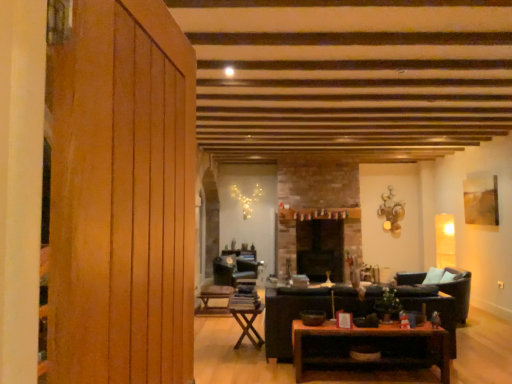
Measure the distance between point (x=421, y=366) and camera.

A distance of 4.20 meters exists between point (x=421, y=366) and camera.

This screenshot has width=512, height=384. Find the location of `brown wooden table at center, the third table from the back`. brown wooden table at center, the third table from the back is located at coordinates (373, 360).

From a real-world perspective, is wooden folding table at center, which is the 3th table from front to back, on black leather couch at center?

Incorrect, from a real-world perspective, wooden folding table at center, which is the 3th table from front to back, is lower than black leather couch at center.

Can you confirm if wooden folding table at center, arranged as the third table when viewed from the right, is bigger than black leather couch at center?

Incorrect, wooden folding table at center, arranged as the third table when viewed from the right, is not larger than black leather couch at center.

Is wooden folding table at center, positioned as the 1th table in back-to-front order, completely or partially outside of black leather couch at center?

Absolutely, wooden folding table at center, positioned as the 1th table in back-to-front order, is external to black leather couch at center.

Does point (251, 264) lie behind point (94, 254)?

Yes, it is behind point (94, 254).

Is the position of velvet dark green armchair at center, marked as the 1th armchair in a left-to-right arrangement, less distant than that of wooden paneling at left?

No, velvet dark green armchair at center, marked as the 1th armchair in a left-to-right arrangement, is behind wooden paneling at left.

Is velvet dark green armchair at center, arranged as the 2th armchair when viewed from the front, positioned far away from wooden paneling at left?

Yes, velvet dark green armchair at center, arranged as the 2th armchair when viewed from the front, and wooden paneling at left are located far from each other.

Is velvet dark green armchair at center, the first armchair when ordered from back to front, completely or partially outside of wooden paneling at left?

Indeed, velvet dark green armchair at center, the first armchair when ordered from back to front, is completely outside wooden paneling at left.

From the image's perspective, between velvet dark green armchair at center, the 2th armchair positioned from the right, and black leather couch at center, who is located below?

velvet dark green armchair at center, the 2th armchair positioned from the right, appears lower in the image.

Considering the relative positions of velvet dark green armchair at center, the 2th armchair positioned from the right, and black leather couch at center in the image provided, is velvet dark green armchair at center, the 2th armchair positioned from the right, to the left or to the right of black leather couch at center?

In the image, velvet dark green armchair at center, the 2th armchair positioned from the right, appears on the left side of black leather couch at center.

Between point (236, 270) and point (283, 322), which one is positioned behind?

Positioned behind is point (236, 270).

Is wooden paneling at left inside the boundaries of velvet dark green armchair at center, the first armchair when ordered from back to front, or outside?

wooden paneling at left is outside velvet dark green armchair at center, the first armchair when ordered from back to front.

Considering the sizes of objects wooden paneling at left and velvet dark green armchair at center, the first armchair when ordered from back to front, in the image provided, who is thinner, wooden paneling at left or velvet dark green armchair at center, the first armchair when ordered from back to front,?

Thinner between the two is wooden paneling at left.

This screenshot has height=384, width=512. I want to click on barn door lying on the right of velvet dark green armchair at center, marked as the 1th armchair in a left-to-right arrangement, so (x=122, y=198).

Is wooden paneling at left next to velvet dark green armchair at center, arranged as the 2th armchair when viewed from the front?

No, wooden paneling at left is not making contact with velvet dark green armchair at center, arranged as the 2th armchair when viewed from the front.

This screenshot has width=512, height=384. In order to click on the 2nd table counting from the left of the brown wooden table at center, which is the 3th table from left to right in this screenshot , I will do `click(214, 298)`.

Does wooden folding table at center, which is the 3th table from front to back, have a greater height compared to brown wooden table at center, marked as the first table in a front-to-back arrangement?

In fact, wooden folding table at center, which is the 3th table from front to back, may be shorter than brown wooden table at center, marked as the first table in a front-to-back arrangement.

Is wooden folding table at center, which is the 3th table from front to back, turned away from brown wooden table at center, which is the 3th table from left to right?

No, wooden folding table at center, which is the 3th table from front to back, is not facing away from brown wooden table at center, which is the 3th table from left to right.

Is dark brown leather armchair at right, which ranks as the 2th armchair in back-to-front order, turned away from brown wooden table at center, the first table from the right?

dark brown leather armchair at right, which ranks as the 2th armchair in back-to-front order, is not turned away from brown wooden table at center, the first table from the right.

Is point (467, 281) behind point (333, 332)?

Yes, it is behind point (333, 332).

Identify the location of table that is above the dark brown leather armchair at right, positioned as the 1th armchair in front-to-back order (from the image's perspective). The height and width of the screenshot is (384, 512). (373, 360).

Based on the photo, can you confirm if dark brown leather armchair at right, which appears as the first armchair when viewed from the right, is wider than brown wooden table at center, which is the 3th table from left to right?

Yes.

From a real-world perspective, who is located higher, brown wooden table at center, which is the 3th table from left to right, or wooden folding table at center, the 2th table from the back?

wooden folding table at center, the 2th table from the back.

Looking at this image, could you tell me if brown wooden table at center, which is the 3th table from left to right, is facing wooden folding table at center, the second table viewed from the left?

No, brown wooden table at center, which is the 3th table from left to right, does not turn towards wooden folding table at center, the second table viewed from the left.

Measure the distance from brown wooden table at center, which is the 3th table from left to right, to wooden folding table at center, the 2th table from the back.

A distance of 3.81 feet exists between brown wooden table at center, which is the 3th table from left to right, and wooden folding table at center, the 2th table from the back.

Is brown wooden table at center, which is the 3th table from left to right, inside or outside of wooden folding table at center, the second table viewed from the left?

brown wooden table at center, which is the 3th table from left to right, lies outside wooden folding table at center, the second table viewed from the left.

You are a GUI agent. You are given a task and a screenshot of the screen. Output one action in this format:
    pyautogui.click(x=<x>, y=<y>)
    Task: Click on the 3rd table positioned below the black leather couch at center (from the image's perspective)
    This screenshot has height=384, width=512.
    Given the screenshot: What is the action you would take?
    pyautogui.click(x=214, y=298)

I want to click on barn door above the velvet dark green armchair at center, the first armchair when ordered from back to front (from the image's perspective), so click(122, 198).

Considering their positions, is brown wooden table at center, the first table from the right, positioned further to wooden folding table at center, which is counted as the 2th table, starting from the front, than wooden folding table at center, arranged as the third table when viewed from the right?

brown wooden table at center, the first table from the right, is positioned further to the anchor wooden folding table at center, which is counted as the 2th table, starting from the front.

Based on their spatial positions, is brown wooden table at center, the third table from the back, or wooden paneling at left further from black leather couch at center?

wooden paneling at left lies further to black leather couch at center than the other object.

Based on their spatial positions, is velvet dark green armchair at center, marked as the 1th armchair in a left-to-right arrangement, or wooden paneling at left further from wooden folding table at center, which ranks as the 1th table in left-to-right order?

The object further to wooden folding table at center, which ranks as the 1th table in left-to-right order, is wooden paneling at left.

Which object lies nearer to the anchor point wooden paneling at left, wooden folding table at center, which ranks as the 1th table in left-to-right order, or brown wooden table at center, which is the 3th table from left to right?

brown wooden table at center, which is the 3th table from left to right, is closer to wooden paneling at left.

Looking at this image, when comparing their distances from dark brown leather armchair at right, positioned as the 1th armchair in front-to-back order, does wooden paneling at left or wooden folding table at center, which appears as the second table when viewed from the right, seem closer?

The object closer to dark brown leather armchair at right, positioned as the 1th armchair in front-to-back order, is wooden folding table at center, which appears as the second table when viewed from the right.

Considering their positions, is wooden folding table at center, which appears as the second table when viewed from the right, positioned further to wooden folding table at center, positioned as the 1th table in back-to-front order, than velvet dark green armchair at center, the first armchair when ordered from back to front?

The object further to wooden folding table at center, positioned as the 1th table in back-to-front order, is wooden folding table at center, which appears as the second table when viewed from the right.

Considering their positions, is dark brown leather armchair at right, which appears as the first armchair when viewed from the right, positioned further to brown wooden table at center, the third table from the back, than black leather couch at center?

Among the two, dark brown leather armchair at right, which appears as the first armchair when viewed from the right, is located further to brown wooden table at center, the third table from the back.

Looking at the image, which one is located closer to black leather couch at center, velvet dark green armchair at center, the first armchair when ordered from back to front, or brown wooden table at center, marked as the first table in a front-to-back arrangement?

Among the two, brown wooden table at center, marked as the first table in a front-to-back arrangement, is located nearer to black leather couch at center.

Where is `studio couch between wooden paneling at left and dark brown leather armchair at right, the 2th armchair viewed from the left, from front to back`? studio couch between wooden paneling at left and dark brown leather armchair at right, the 2th armchair viewed from the left, from front to back is located at coordinates pos(298,314).

Locate an element on the screen. The height and width of the screenshot is (384, 512). studio couch between wooden folding table at center, positioned as the 1th table in back-to-front order, and dark brown leather armchair at right, positioned as the 1th armchair in front-to-back order, from left to right is located at coordinates (298, 314).

The image size is (512, 384). What are the coordinates of `studio couch between brown wooden table at center, which is the 3th table from left to right, and wooden folding table at center, which is the 3th table from front to back, along the z-axis` in the screenshot? It's located at (298, 314).

Image resolution: width=512 pixels, height=384 pixels. What are the coordinates of `table positioned between wooden paneling at left and wooden folding table at center, the 2th table from the back, from near to far` in the screenshot? It's located at (373, 360).